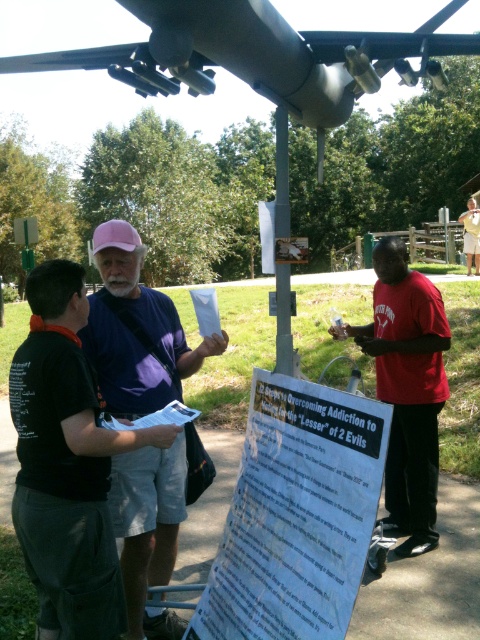
Which is below, pink fabric cap at upper left or matte red shirt at right?

pink fabric cap at upper left

Which is in front, point (180, 337) or point (442, 307)?

Point (180, 337) is in front.

Describe the element at coordinates (136, 330) in the screenshot. The image size is (480, 640). I see `pink fabric cap at upper left` at that location.

The image size is (480, 640). I want to click on pink fabric cap at upper left, so click(136, 330).

Is metallic signpost at center positioned before red shirt at right?

Yes, it is in front of red shirt at right.

Can you confirm if metallic signpost at center is wider than red shirt at right?

No, metallic signpost at center is not wider than red shirt at right.

From the picture: Who is more forward, (276, 214) or (476, 273)?

Point (276, 214) is in front.

Find the location of a particular element. This screenshot has width=480, height=640. metallic signpost at center is located at coordinates (282, 173).

Can you confirm if matte red shirt at right is bigger than metallic signpost at center?

No, matte red shirt at right is not bigger than metallic signpost at center.

Is matte red shirt at right in front of metallic signpost at center?

Yes.

Is point (433, 314) more distant than point (284, 131)?

No, it is not.

Where is `matte red shirt at right`? Image resolution: width=480 pixels, height=640 pixels. matte red shirt at right is located at coordinates (407, 388).